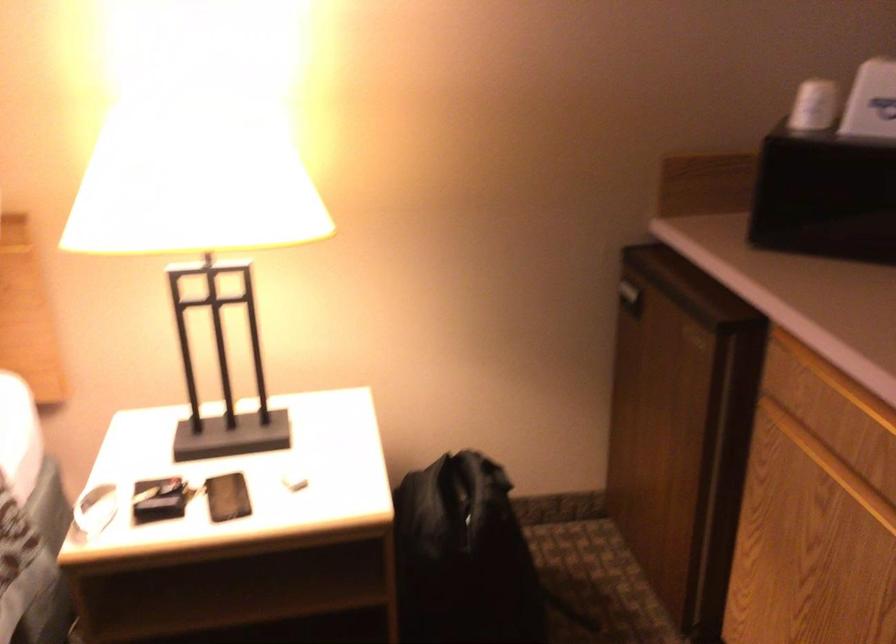
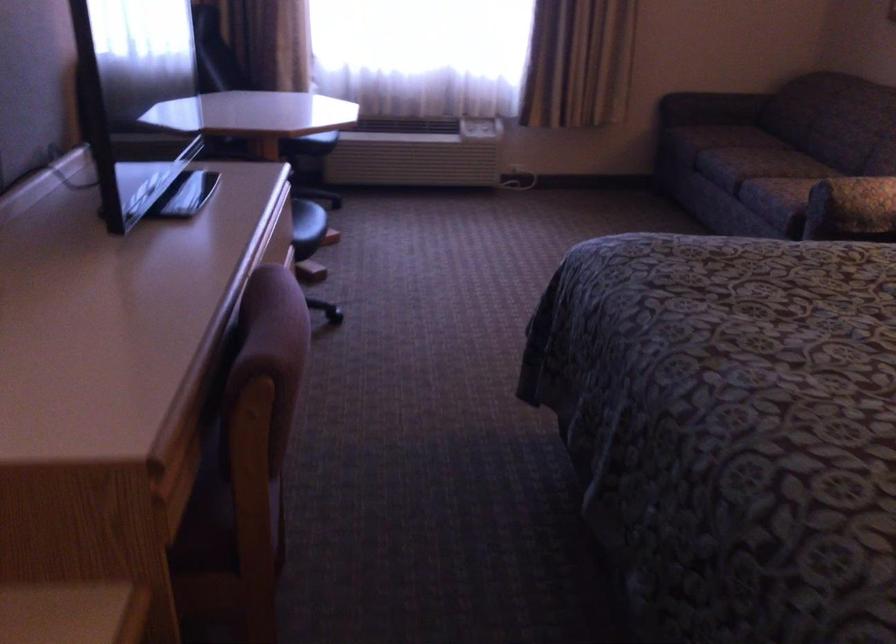
The first image is from the beginning of the video and the second image is from the end. How did the camera likely rotate when shooting the video?

The camera's rotation is toward left-down.